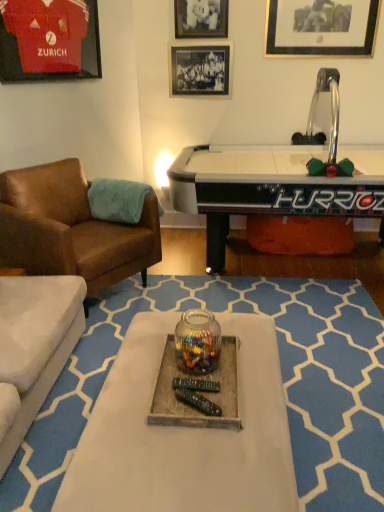
Identify the location of vacant area that is in front of black plastic remote control at center, which is counted as the 2th remote control, starting from the front. (196, 413).